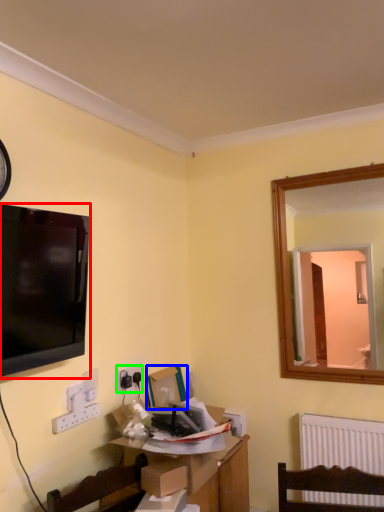
Question: Considering the real-world distances, which object is closest to television (highlighted by a red box)? box (highlighted by a blue box) or electric outlet (highlighted by a green box).

Choices:
 (A) box
 (B) electric outlet

Answer: (B)